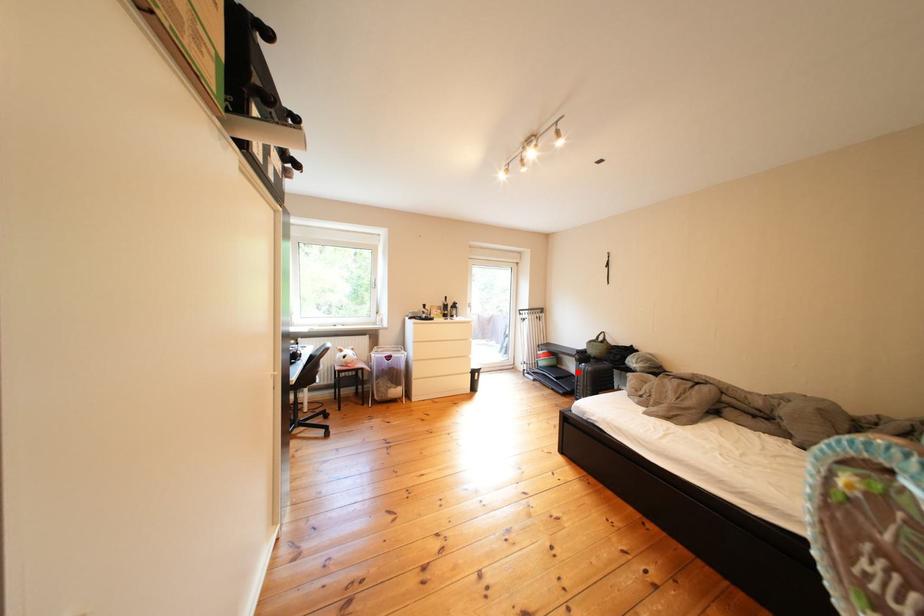
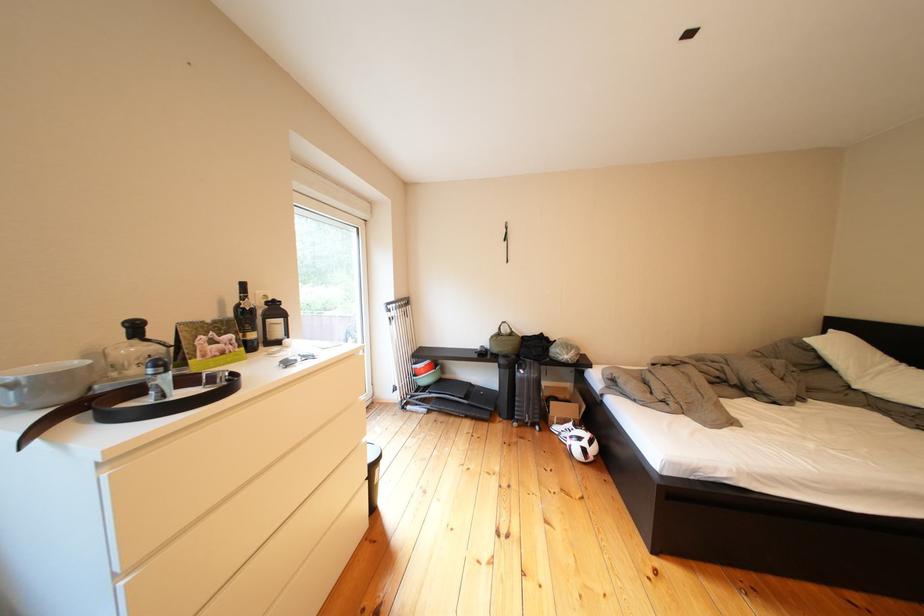
Locate, in the second image, the point that corresponds to the highlighted location in the first image.

(462, 381)